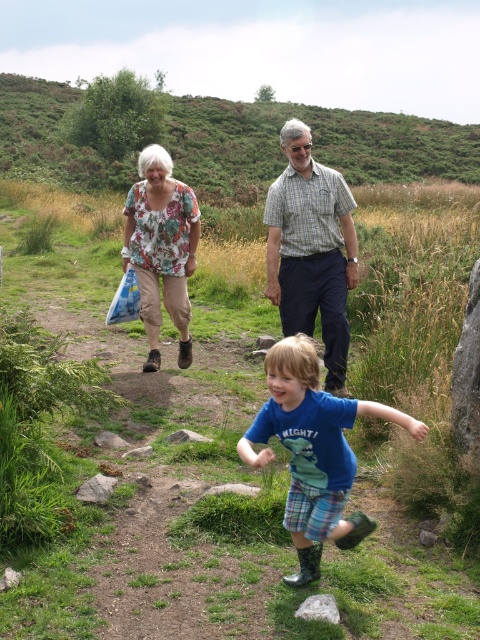
Does green grassy at center appear on the right side of green grassy hillside at upper center?

Yes, green grassy at center is to the right of green grassy hillside at upper center.

Identify the location of green grassy at center. (194, 468).

Locate an element on the screen. green grassy at center is located at coordinates (194, 468).

Where is `green grassy at center`? green grassy at center is located at coordinates [194, 468].

Can you confirm if green grassy hillside at upper center is taller than floral blouse at center?

Yes, green grassy hillside at upper center is taller than floral blouse at center.

Does green grassy hillside at upper center come in front of floral blouse at center?

No, green grassy hillside at upper center is further to the viewer.

This screenshot has height=640, width=480. What are the coordinates of `green grassy hillside at upper center` in the screenshot? It's located at (313, 144).

Who is more distant from viewer, (295, 154) or (126, 221)?

Point (126, 221)

Based on the photo, is checkered fabric shirt at center to the left of floral blouse at center from the viewer's perspective?

No, checkered fabric shirt at center is not to the left of floral blouse at center.

The image size is (480, 640). What are the coordinates of `checkered fabric shirt at center` in the screenshot? It's located at (311, 248).